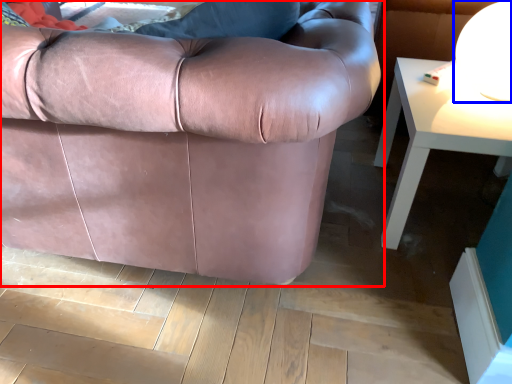
Question: Which of the following is the farthest to the observer, studio couch (highlighted by a red box) or table lamp (highlighted by a blue box)?

Choices:
 (A) studio couch
 (B) table lamp

Answer: (B)